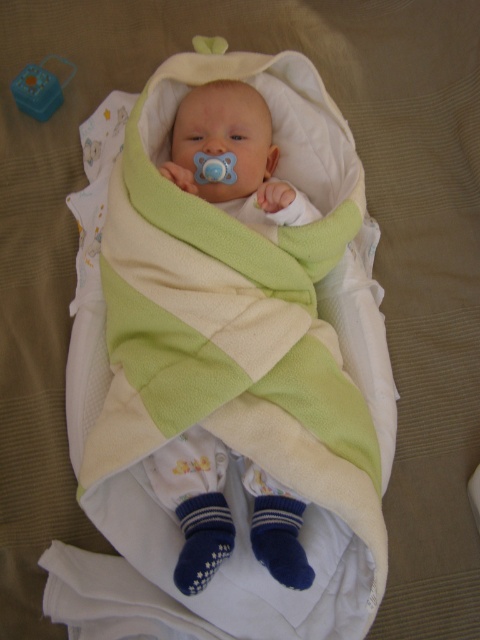
Question: Can you confirm if soft fleece baby at center is smaller than blue plastic toy at upper left?

Choices:
 (A) no
 (B) yes

Answer: (A)

Question: Which of the following is the closest to the observer?

Choices:
 (A) blue rubber pacifier at center
 (B) soft fleece baby at center

Answer: (B)

Question: Which object is the closest to the blue plastic toy at upper left?

Choices:
 (A) blue rubber pacifier at center
 (B) soft fleece baby at center

Answer: (A)

Question: Does blue plastic toy at upper left appear on the left side of blue rubber pacifier at center?

Choices:
 (A) yes
 (B) no

Answer: (A)

Question: Is soft fleece baby at center to the left of blue rubber pacifier at center from the viewer's perspective?

Choices:
 (A) yes
 (B) no

Answer: (B)

Question: Which object is closer to the camera taking this photo?

Choices:
 (A) blue plastic toy at upper left
 (B) blue rubber pacifier at center
 (C) soft fleece baby at center

Answer: (C)